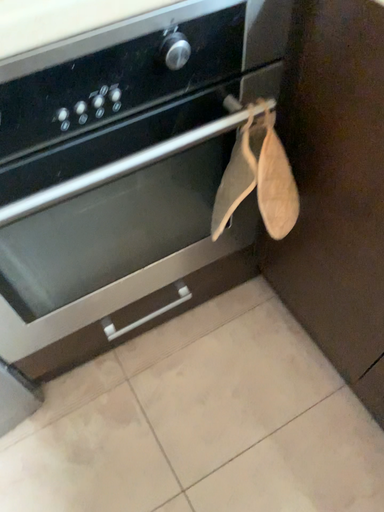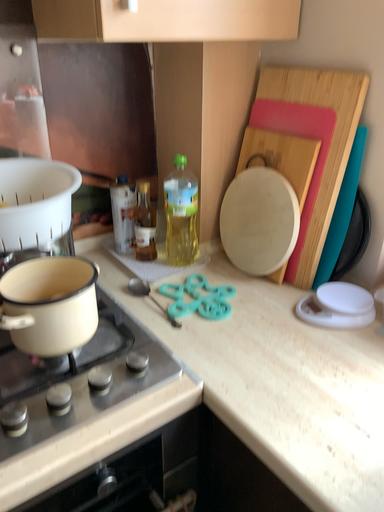
Question: Which way did the camera rotate in the video?

Choices:
 (A) rotated downward
 (B) rotated upward

Answer: (B)